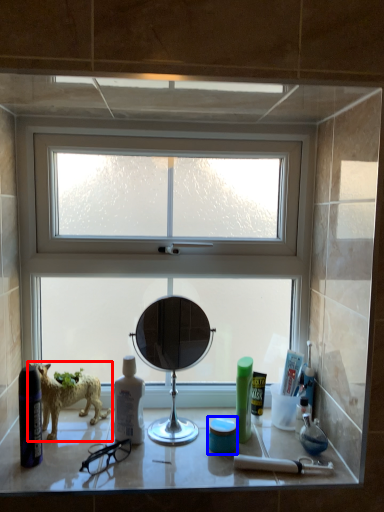
Question: Which object appears closest to the camera in this image, dog (highlighted by a red box) or mouthwash (highlighted by a blue box)?

Choices:
 (A) dog
 (B) mouthwash

Answer: (B)